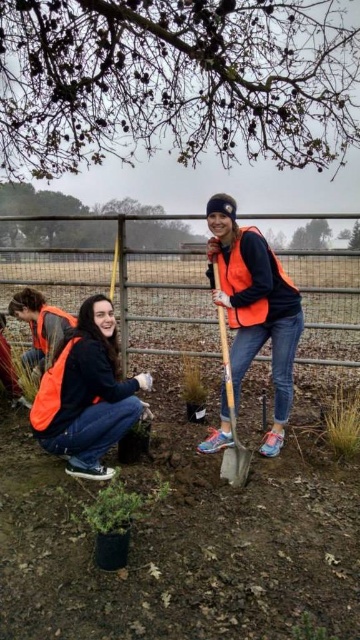
Is smooth bark tree at upper center below matte black jacket at lower left?

Actually, smooth bark tree at upper center is above matte black jacket at lower left.

Looking at this image, is smooth bark tree at upper center wider than matte black jacket at lower left?

Yes, smooth bark tree at upper center is wider than matte black jacket at lower left.

Who is more distant from viewer, (x=88, y=138) or (x=101, y=317)?

The point (x=88, y=138) is behind.

Where is `smooth bark tree at upper center`? This screenshot has height=640, width=360. smooth bark tree at upper center is located at coordinates (174, 81).

This screenshot has width=360, height=640. What are the coordinates of `smooth bark tree at upper center` in the screenshot? It's located at (174, 81).

From the picture: Who is more distant from viewer, (253,161) or (214,284)?

The point (253,161) is more distant.

Locate an element on the screen. This screenshot has width=360, height=640. smooth bark tree at upper center is located at coordinates (174, 81).

Consider the image. Can you confirm if smooth bark tree at upper center is positioned below orange reflective vest at center?

No.

Who is more forward, (326, 13) or (289, 346)?

Point (289, 346)

Where is `smooth bark tree at upper center`? Image resolution: width=360 pixels, height=640 pixels. smooth bark tree at upper center is located at coordinates (174, 81).